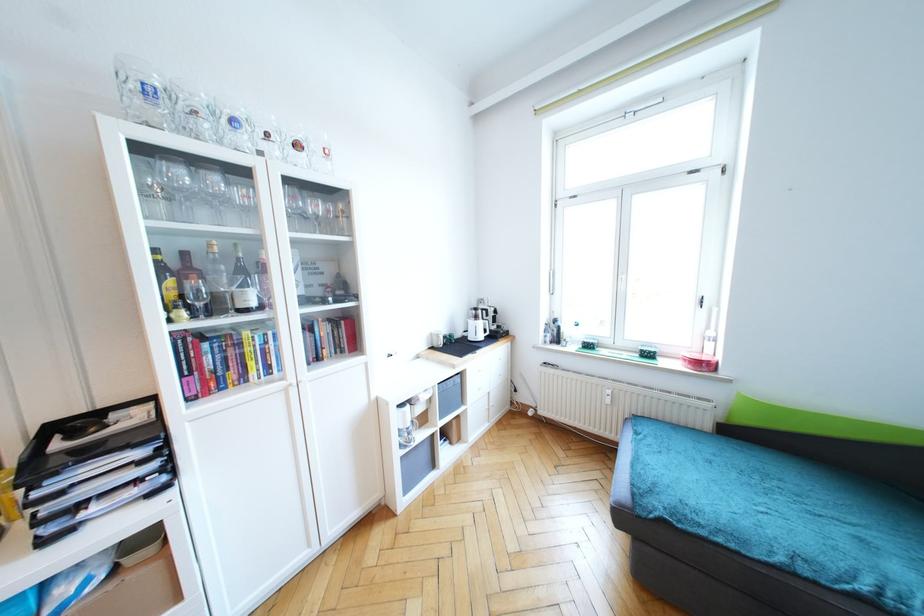
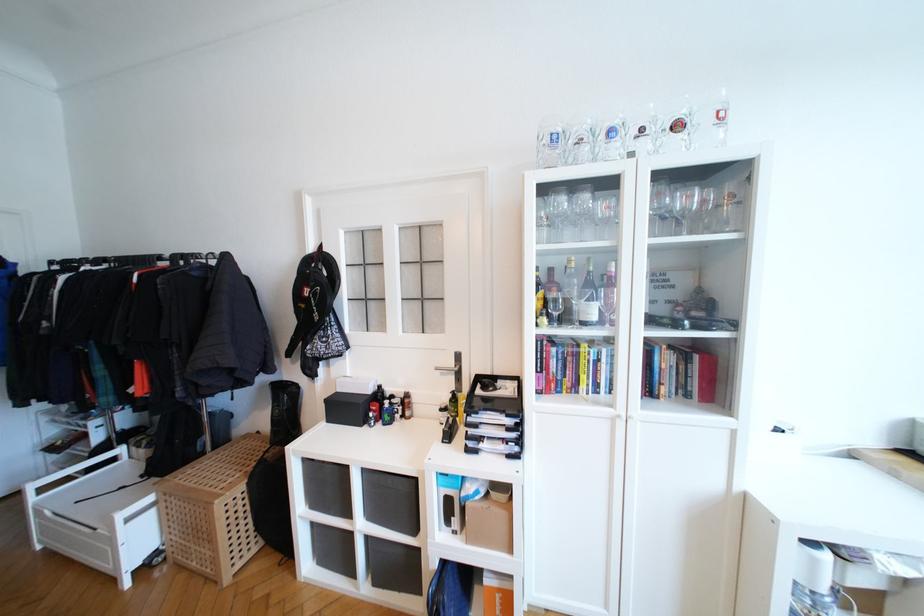
Find the pixel in the second image that matches (320,208) in the first image.

(691, 200)